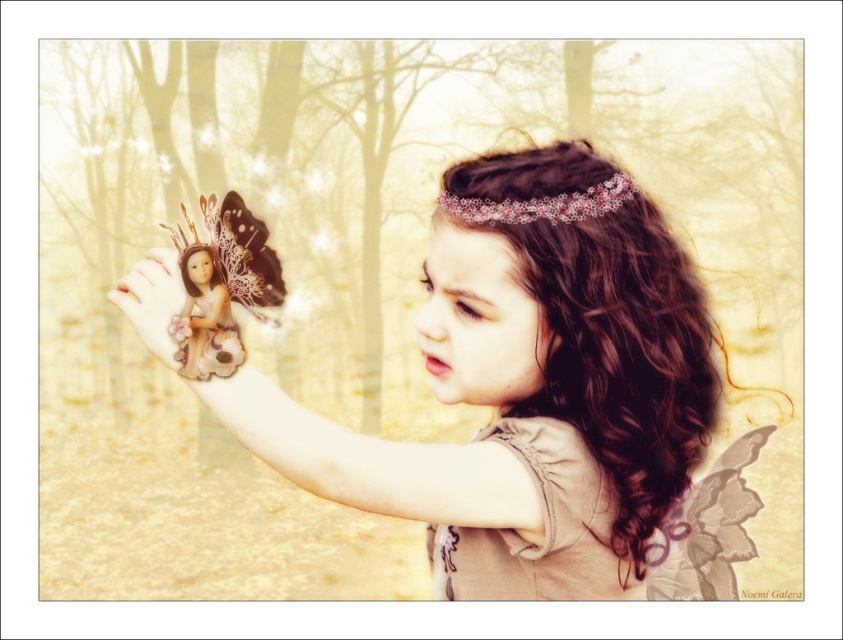
The scene shows a young girl in a forest with two items in the background. Which object, the matte brown fairy doll at upper left or the pink lace tiara at upper center, is larger in size?

The matte brown fairy doll at upper left is bigger than the pink lace tiara at upper center according to the description.

What is the location of the point with coordinates (205, 317) in the image?

The point with coordinates (205, 317) is located on the smooth porcelain doll at center.